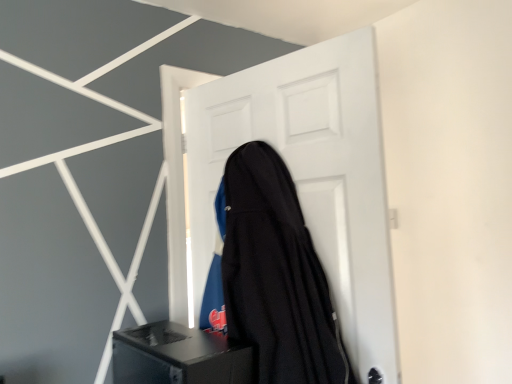
Question: Can you confirm if black fabric guitar case at center is shorter than white matte door at center?

Choices:
 (A) yes
 (B) no

Answer: (A)

Question: Are black fabric guitar case at center and white matte door at center located far from each other?

Choices:
 (A) yes
 (B) no

Answer: (B)

Question: From a real-world perspective, is black fabric guitar case at center located higher than white matte door at center?

Choices:
 (A) no
 (B) yes

Answer: (A)

Question: Is black fabric guitar case at center positioned beyond the bounds of white matte door at center?

Choices:
 (A) no
 (B) yes

Answer: (B)

Question: From a real-world perspective, is black fabric guitar case at center physically below white matte door at center?

Choices:
 (A) yes
 (B) no

Answer: (A)

Question: From the image's perspective, is black fabric guitar case at center positioned above or below black matte speaker at lower center?

Choices:
 (A) below
 (B) above

Answer: (B)

Question: Would you say black fabric guitar case at center is inside or outside black matte speaker at lower center?

Choices:
 (A) inside
 (B) outside

Answer: (B)

Question: From a real-world perspective, is black fabric guitar case at center physically located above or below black matte speaker at lower center?

Choices:
 (A) above
 (B) below

Answer: (A)

Question: Based on their sizes in the image, would you say black fabric guitar case at center is bigger or smaller than black matte speaker at lower center?

Choices:
 (A) big
 (B) small

Answer: (A)

Question: Is black matte speaker at lower center bigger or smaller than black fabric guitar case at center?

Choices:
 (A) big
 (B) small

Answer: (B)

Question: Considering the positions of black matte speaker at lower center and black fabric guitar case at center in the image, is black matte speaker at lower center taller or shorter than black fabric guitar case at center?

Choices:
 (A) tall
 (B) short

Answer: (B)

Question: From the image's perspective, is black matte speaker at lower center positioned above or below black fabric guitar case at center?

Choices:
 (A) below
 (B) above

Answer: (A)

Question: Is black matte speaker at lower center to the left or to the right of black fabric guitar case at center in the image?

Choices:
 (A) left
 (B) right

Answer: (A)

Question: Is white matte door at center bigger or smaller than black fabric guitar case at center?

Choices:
 (A) big
 (B) small

Answer: (A)

Question: In terms of height, does white matte door at center look taller or shorter compared to black fabric guitar case at center?

Choices:
 (A) short
 (B) tall

Answer: (B)